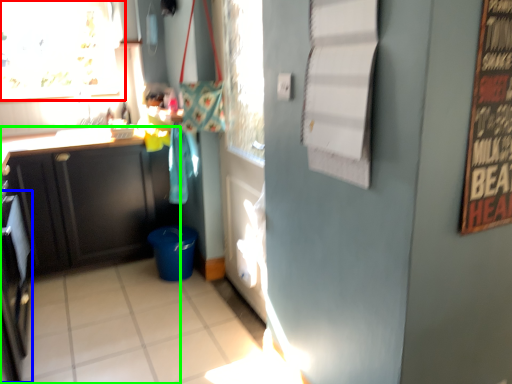
Question: Which object is positioned farthest from window (highlighted by a red box)? Select from appliance (highlighted by a blue box) and cabinetry (highlighted by a green box).

Choices:
 (A) appliance
 (B) cabinetry

Answer: (A)